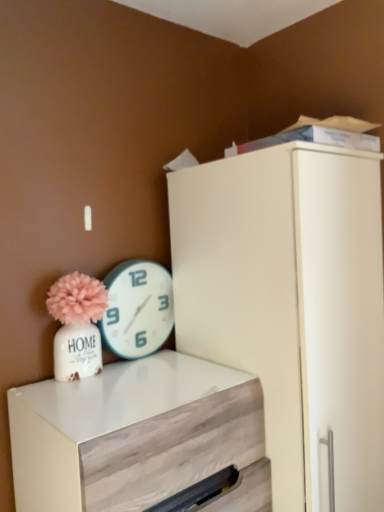
Question: Looking at the image, does teal plastic wall clock at upper center seem bigger or smaller compared to white wood chest of drawers at lower left?

Choices:
 (A) small
 (B) big

Answer: (A)

Question: Looking at their shapes, would you say teal plastic wall clock at upper center is wider or thinner than white wood chest of drawers at lower left?

Choices:
 (A) wide
 (B) thin

Answer: (B)

Question: Would you say teal plastic wall clock at upper center is to the left or to the right of white wood chest of drawers at lower left in the picture?

Choices:
 (A) right
 (B) left

Answer: (B)

Question: Choose the correct answer: Is white wood chest of drawers at lower left inside teal plastic wall clock at upper center or outside it?

Choices:
 (A) outside
 (B) inside

Answer: (A)

Question: Relative to teal plastic wall clock at upper center, is white wood chest of drawers at lower left in front or behind?

Choices:
 (A) behind
 (B) front

Answer: (B)

Question: In terms of height, does white wood chest of drawers at lower left look taller or shorter compared to teal plastic wall clock at upper center?

Choices:
 (A) short
 (B) tall

Answer: (B)

Question: Would you say white wood chest of drawers at lower left is to the left or to the right of teal plastic wall clock at upper center in the picture?

Choices:
 (A) right
 (B) left

Answer: (A)